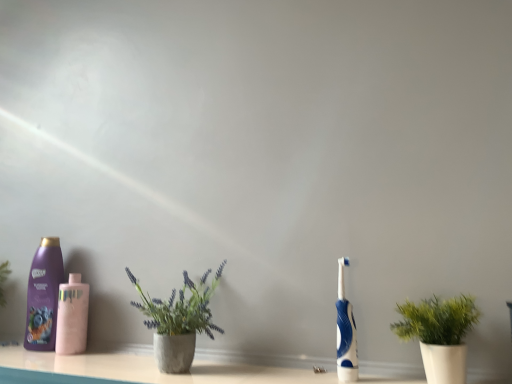
Locate an element on the screen. green matte plant at right, placed as the first houseplant when sorted from right to left is located at coordinates [439, 334].

Image resolution: width=512 pixels, height=384 pixels. I want to click on concrete textured pot at center, the first houseplant when ordered from left to right, so click(178, 321).

At what (x,y) coordinates should I click in order to perform the action: click on pink matte bottle at left, the 1th bottle from the right. Please return your answer as a coordinate pair (x, y). Looking at the image, I should click on (72, 316).

Can you confirm if blue rubber toothbrush at right is positioned to the right of purple glossy shampoo at left, the first bottle positioned from the left?

Yes, blue rubber toothbrush at right is to the right of purple glossy shampoo at left, the first bottle positioned from the left.

Is blue rubber toothbrush at right completely or partially outside of purple glossy shampoo at left, the first bottle positioned from the left?

blue rubber toothbrush at right is positioned outside purple glossy shampoo at left, the first bottle positioned from the left.

Based on their sizes in the image, would you say blue rubber toothbrush at right is bigger or smaller than purple glossy shampoo at left, the first bottle positioned from the left?

Considering their sizes, blue rubber toothbrush at right takes up less space than purple glossy shampoo at left, the first bottle positioned from the left.

Is blue rubber toothbrush at right wider than purple glossy shampoo at left, the first bottle positioned from the left?

No.

Is purple glossy shampoo at left, which appears as the second bottle when viewed from the right, surrounding concrete textured pot at center, the first houseplant when ordered from left to right?

No, concrete textured pot at center, the first houseplant when ordered from left to right, is not surrounded by purple glossy shampoo at left, which appears as the second bottle when viewed from the right.

Based on the photo, is purple glossy shampoo at left, which appears as the second bottle when viewed from the right, positioned with its back to concrete textured pot at center, which ranks as the second houseplant in right-to-left order?

purple glossy shampoo at left, which appears as the second bottle when viewed from the right, does not have its back to concrete textured pot at center, which ranks as the second houseplant in right-to-left order.

Is purple glossy shampoo at left, the first bottle positioned from the left, wider than concrete textured pot at center, which ranks as the second houseplant in right-to-left order?

In fact, purple glossy shampoo at left, the first bottle positioned from the left, might be narrower than concrete textured pot at center, which ranks as the second houseplant in right-to-left order.

Considering the relative sizes of purple glossy shampoo at left, the first bottle positioned from the left, and concrete textured pot at center, the first houseplant when ordered from left to right, in the image provided, is purple glossy shampoo at left, the first bottle positioned from the left, smaller than concrete textured pot at center, the first houseplant when ordered from left to right,?

Yes, purple glossy shampoo at left, the first bottle positioned from the left, is smaller than concrete textured pot at center, the first houseplant when ordered from left to right.

In the scene shown: Is green matte plant at right, placed as the first houseplant when sorted from right to left, not close to pink matte bottle at left, the second bottle positioned from the left?

No, green matte plant at right, placed as the first houseplant when sorted from right to left, is not far from pink matte bottle at left, the second bottle positioned from the left.

From the image's perspective, would you say green matte plant at right, placed as the first houseplant when sorted from right to left, is shown under pink matte bottle at left, the 1th bottle from the right?

Actually, green matte plant at right, placed as the first houseplant when sorted from right to left, appears above pink matte bottle at left, the 1th bottle from the right, in the image.

Based on their sizes in the image, would you say green matte plant at right, placed as the first houseplant when sorted from right to left, is bigger or smaller than pink matte bottle at left, the 1th bottle from the right?

Clearly, green matte plant at right, placed as the first houseplant when sorted from right to left, is larger in size than pink matte bottle at left, the 1th bottle from the right.

From a real-world perspective, which object stands above the other?

pink matte bottle at left, the 1th bottle from the right, from a real-world perspective.

Starting from the pink matte bottle at left, the second bottle positioned from the left, which houseplant is the 1st one to the right? Please provide its 2D coordinates.

[(178, 321)]

Which object is further away from the camera taking this photo, pink matte bottle at left, the second bottle positioned from the left, or concrete textured pot at center, the first houseplant when ordered from left to right?

pink matte bottle at left, the second bottle positioned from the left, is further from the camera.

Is point (62, 338) closer or farther from the camera than point (188, 299)?

Point (62, 338) is farther from the camera than point (188, 299).

From a real-world perspective, is pink matte bottle at left, the 1th bottle from the right, positioned over concrete textured pot at center, the first houseplant when ordered from left to right, based on gravity?

No, from a real-world perspective, pink matte bottle at left, the 1th bottle from the right, is not on top of concrete textured pot at center, the first houseplant when ordered from left to right.

Is purple glossy shampoo at left, the first bottle positioned from the left, inside concrete textured pot at center, the first houseplant when ordered from left to right?

No, purple glossy shampoo at left, the first bottle positioned from the left, is not surrounded by concrete textured pot at center, the first houseplant when ordered from left to right.

From a real-world perspective, does concrete textured pot at center, the first houseplant when ordered from left to right, stand above purple glossy shampoo at left, which appears as the second bottle when viewed from the right?

Actually, concrete textured pot at center, the first houseplant when ordered from left to right, is physically below purple glossy shampoo at left, which appears as the second bottle when viewed from the right, in the real world.

Is there a large distance between concrete textured pot at center, which ranks as the second houseplant in right-to-left order, and purple glossy shampoo at left, which appears as the second bottle when viewed from the right?

That's not correct — concrete textured pot at center, which ranks as the second houseplant in right-to-left order, is a little close to purple glossy shampoo at left, which appears as the second bottle when viewed from the right.

Considering the sizes of objects concrete textured pot at center, which ranks as the second houseplant in right-to-left order, and purple glossy shampoo at left, which appears as the second bottle when viewed from the right, in the image provided, who is bigger, concrete textured pot at center, which ranks as the second houseplant in right-to-left order, or purple glossy shampoo at left, which appears as the second bottle when viewed from the right,?

With larger size is concrete textured pot at center, which ranks as the second houseplant in right-to-left order.

Which is correct: green matte plant at right, placed as the first houseplant when sorted from right to left, is inside purple glossy shampoo at left, which appears as the second bottle when viewed from the right, or outside of it?

green matte plant at right, placed as the first houseplant when sorted from right to left, cannot be found inside purple glossy shampoo at left, which appears as the second bottle when viewed from the right.

Looking at this image, can you confirm if green matte plant at right, placed as the first houseplant when sorted from right to left, is bigger than purple glossy shampoo at left, which appears as the second bottle when viewed from the right?

Indeed, green matte plant at right, placed as the first houseplant when sorted from right to left, has a larger size compared to purple glossy shampoo at left, which appears as the second bottle when viewed from the right.

Is point (435, 373) closer or farther from the camera than point (45, 337)?

Point (435, 373) is positioned closer to the camera compared to point (45, 337).

Could you tell me if green matte plant at right, the 2th houseplant when ordered from left to right, is facing purple glossy shampoo at left, which appears as the second bottle when viewed from the right?

No, green matte plant at right, the 2th houseplant when ordered from left to right, is not aimed at purple glossy shampoo at left, which appears as the second bottle when viewed from the right.

Could you tell me if pink matte bottle at left, the 1th bottle from the right, is facing blue rubber toothbrush at right?

No, pink matte bottle at left, the 1th bottle from the right, is not oriented towards blue rubber toothbrush at right.

Between pink matte bottle at left, the second bottle positioned from the left, and blue rubber toothbrush at right, which one has smaller size?

Smaller between the two is blue rubber toothbrush at right.

Between pink matte bottle at left, the 1th bottle from the right, and blue rubber toothbrush at right, which one is positioned behind?

pink matte bottle at left, the 1th bottle from the right, is further away from the camera.

How different are the orientations of pink matte bottle at left, the 1th bottle from the right, and blue rubber toothbrush at right in degrees?

5.11 degrees.

The height and width of the screenshot is (384, 512). Identify the location of bottle located above the blue rubber toothbrush at right (from a real-world perspective). (42, 295).

From the purple glossy shampoo at left, the first bottle positioned from the left, count 1st houseplants forward and point to it. Please provide its 2D coordinates.

[(178, 321)]

Which object lies further to the anchor point blue rubber toothbrush at right, green matte plant at right, placed as the first houseplant when sorted from right to left, or concrete textured pot at center, the first houseplant when ordered from left to right?

concrete textured pot at center, the first houseplant when ordered from left to right, is positioned further to the anchor blue rubber toothbrush at right.

Based on their spatial positions, is blue rubber toothbrush at right or purple glossy shampoo at left, the first bottle positioned from the left, closer to green matte plant at right, the 2th houseplant when ordered from left to right?

blue rubber toothbrush at right.

Looking at the image, which one is located closer to blue rubber toothbrush at right, pink matte bottle at left, the 1th bottle from the right, or green matte plant at right, placed as the first houseplant when sorted from right to left?

green matte plant at right, placed as the first houseplant when sorted from right to left, is positioned closer to the anchor blue rubber toothbrush at right.

When comparing their distances from concrete textured pot at center, the first houseplant when ordered from left to right, does green matte plant at right, placed as the first houseplant when sorted from right to left, or blue rubber toothbrush at right seem further?

Based on the image, green matte plant at right, placed as the first houseplant when sorted from right to left, appears to be further to concrete textured pot at center, the first houseplant when ordered from left to right.

From the image, which object appears to be nearer to purple glossy shampoo at left, the first bottle positioned from the left, concrete textured pot at center, which ranks as the second houseplant in right-to-left order, or pink matte bottle at left, the second bottle positioned from the left?

Among the two, pink matte bottle at left, the second bottle positioned from the left, is located nearer to purple glossy shampoo at left, the first bottle positioned from the left.

Considering their positions, is pink matte bottle at left, the 1th bottle from the right, positioned closer to green matte plant at right, the 2th houseplant when ordered from left to right, than purple glossy shampoo at left, which appears as the second bottle when viewed from the right?

Based on the image, pink matte bottle at left, the 1th bottle from the right, appears to be nearer to green matte plant at right, the 2th houseplant when ordered from left to right.

Based on their spatial positions, is blue rubber toothbrush at right or green matte plant at right, the 2th houseplant when ordered from left to right, further from purple glossy shampoo at left, the first bottle positioned from the left?

green matte plant at right, the 2th houseplant when ordered from left to right, lies further to purple glossy shampoo at left, the first bottle positioned from the left, than the other object.

Looking at this image, from the image, which object appears to be farther from green matte plant at right, placed as the first houseplant when sorted from right to left, blue rubber toothbrush at right or concrete textured pot at center, the first houseplant when ordered from left to right?

concrete textured pot at center, the first houseplant when ordered from left to right, is further to green matte plant at right, placed as the first houseplant when sorted from right to left.

Locate an element on the screen. bottle between purple glossy shampoo at left, which appears as the second bottle when viewed from the right, and concrete textured pot at center, the first houseplant when ordered from left to right, in the horizontal direction is located at coordinates (72, 316).

Image resolution: width=512 pixels, height=384 pixels. In order to click on bottle located between purple glossy shampoo at left, which appears as the second bottle when viewed from the right, and green matte plant at right, the 2th houseplant when ordered from left to right, in the left-right direction in this screenshot , I will do `click(72, 316)`.

You are a GUI agent. You are given a task and a screenshot of the screen. Output one action in this format:
    pyautogui.click(x=<x>, y=<y>)
    Task: Click on the toothbrush between purple glossy shampoo at left, the first bottle positioned from the left, and green matte plant at right, the 2th houseplant when ordered from left to right, from left to right
    The height and width of the screenshot is (384, 512).
    Given the screenshot: What is the action you would take?
    pyautogui.click(x=345, y=332)

In order to click on houseplant situated between purple glossy shampoo at left, which appears as the second bottle when viewed from the right, and blue rubber toothbrush at right from left to right in this screenshot , I will do `click(178, 321)`.